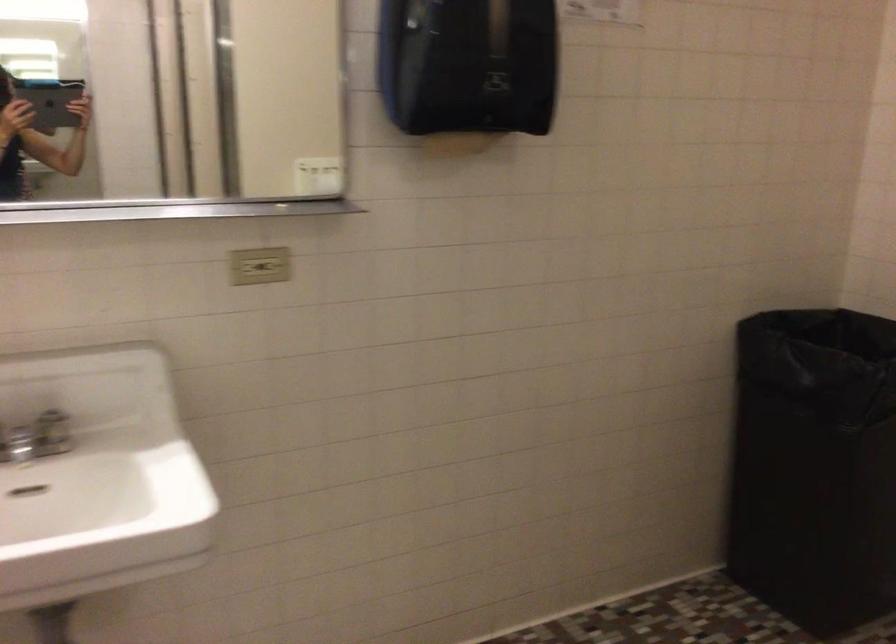
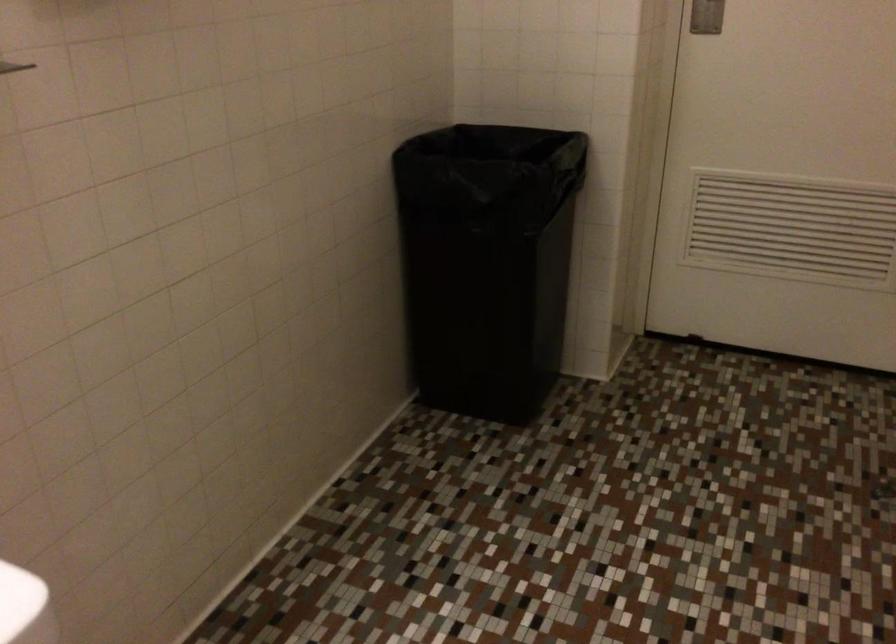
Question: Based on the continuous images, in which direction is the camera rotating? Reply with the corresponding letter.

Choices:
 (A) Left
 (B) Right
 (C) Up
 (D) Down

Answer: (B)